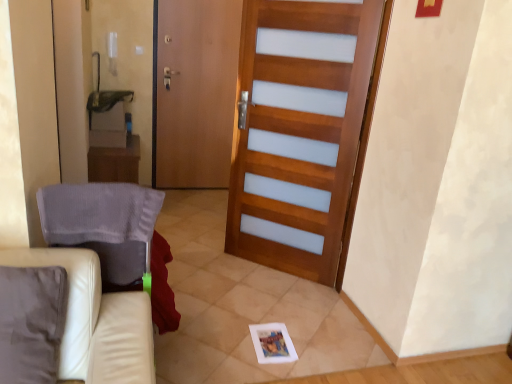
Question: Can you confirm if white leather couch at lower left is thinner than wooden screen door at center?

Choices:
 (A) yes
 (B) no

Answer: (B)

Question: From the image's perspective, is white leather couch at lower left below wooden screen door at center?

Choices:
 (A) yes
 (B) no

Answer: (A)

Question: Is white leather couch at lower left not inside wooden screen door at center?

Choices:
 (A) yes
 (B) no

Answer: (A)

Question: Considering the relative sizes of white leather couch at lower left and wooden screen door at center in the image provided, is white leather couch at lower left wider than wooden screen door at center?

Choices:
 (A) no
 (B) yes

Answer: (B)

Question: From the image's perspective, is white leather couch at lower left on wooden screen door at center?

Choices:
 (A) no
 (B) yes

Answer: (A)

Question: Is point (97, 155) positioned closer to the camera than point (126, 337)?

Choices:
 (A) farther
 (B) closer

Answer: (A)

Question: Looking at the image, does wooden table at left seem bigger or smaller compared to white leather couch at lower left?

Choices:
 (A) big
 (B) small

Answer: (A)

Question: Choose the correct answer: Is wooden table at left inside white leather couch at lower left or outside it?

Choices:
 (A) inside
 (B) outside

Answer: (B)

Question: From the image's perspective, relative to white leather couch at lower left, is wooden table at left above or below?

Choices:
 (A) below
 (B) above

Answer: (B)

Question: Based on their sizes in the image, would you say wooden screen door at center is bigger or smaller than wooden barn door at center?

Choices:
 (A) big
 (B) small

Answer: (B)

Question: Is point (226, 0) closer or farther from the camera than point (325, 261)?

Choices:
 (A) farther
 (B) closer

Answer: (A)

Question: From a real-world perspective, is wooden screen door at center positioned above or below wooden barn door at center?

Choices:
 (A) below
 (B) above

Answer: (B)

Question: Choose the correct answer: Is wooden screen door at center inside wooden barn door at center or outside it?

Choices:
 (A) inside
 (B) outside

Answer: (B)

Question: Choose the correct answer: Is gray fabric armchair at left inside wooden barn door at center or outside it?

Choices:
 (A) inside
 (B) outside

Answer: (B)

Question: In the image, is gray fabric armchair at left on the left side or the right side of wooden barn door at center?

Choices:
 (A) right
 (B) left

Answer: (B)